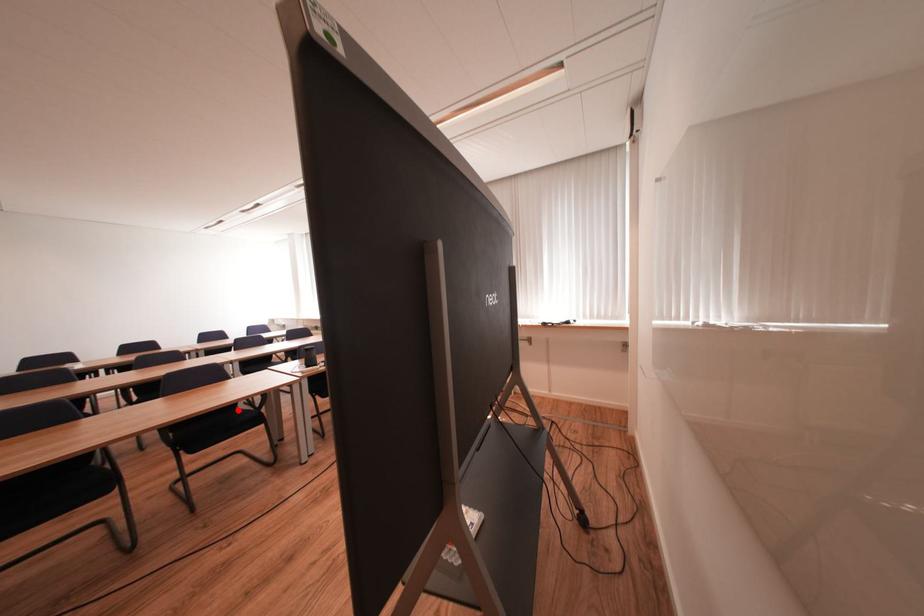
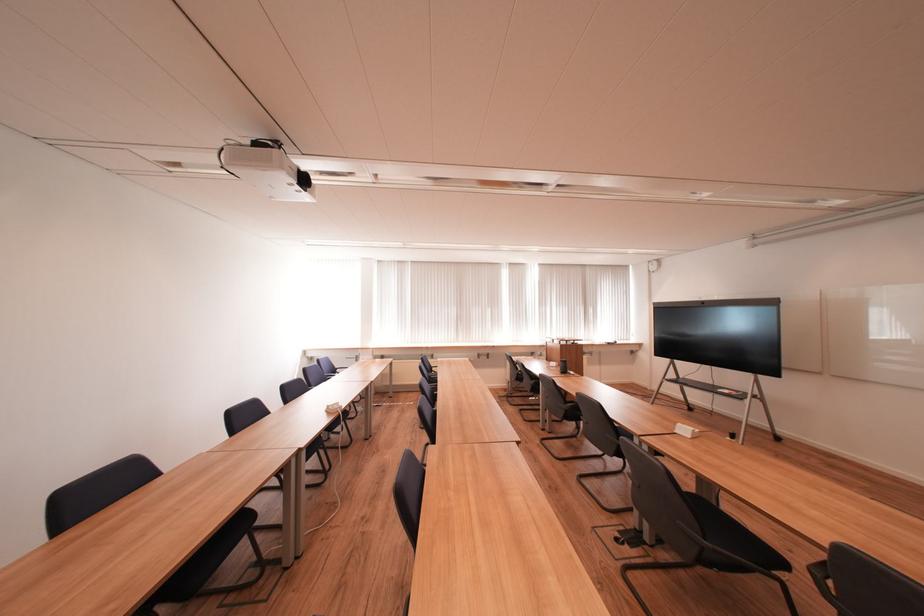
Question: I am providing you with two images of the same scene from different viewpoints. A red point is marked on the first image. At the location where the point appears in image 1, is it still visible in image 2?

Choices:
 (A) Yes
 (B) No

Answer: (B)